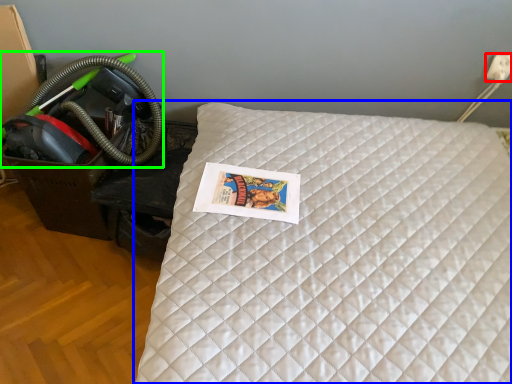
Question: Which object is positioned closest to electric outlet (highlighted by a red box)? Select from bed (highlighted by a blue box) and garden hose (highlighted by a green box).

Choices:
 (A) bed
 (B) garden hose

Answer: (A)